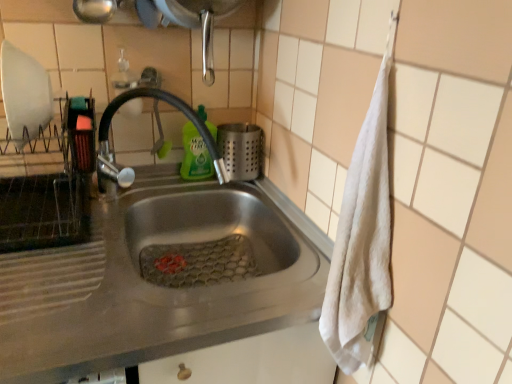
Question: Is satin silver utensil holder at sink bigger than stainless steel sink at center?

Choices:
 (A) no
 (B) yes

Answer: (A)

Question: From a real-world perspective, is satin silver utensil holder at sink physically above stainless steel sink at center?

Choices:
 (A) no
 (B) yes

Answer: (B)

Question: Does satin silver utensil holder at sink have a smaller size compared to stainless steel sink at center?

Choices:
 (A) yes
 (B) no

Answer: (A)

Question: Is satin silver utensil holder at sink aimed at stainless steel sink at center?

Choices:
 (A) yes
 (B) no

Answer: (B)

Question: From the image's perspective, would you say satin silver utensil holder at sink is shown under stainless steel sink at center?

Choices:
 (A) no
 (B) yes

Answer: (A)

Question: Does satin silver utensil holder at sink have a lesser width compared to stainless steel sink at center?

Choices:
 (A) no
 (B) yes

Answer: (B)

Question: Is satin silver utensil holder at sink oriented away from shiny metallic faucet at center?

Choices:
 (A) yes
 (B) no

Answer: (B)

Question: Is the depth of satin silver utensil holder at sink less than that of shiny metallic faucet at center?

Choices:
 (A) no
 (B) yes

Answer: (A)

Question: Is satin silver utensil holder at sink outside of shiny metallic faucet at center?

Choices:
 (A) yes
 (B) no

Answer: (A)

Question: From the image's perspective, does satin silver utensil holder at sink appear lower than shiny metallic faucet at center?

Choices:
 (A) yes
 (B) no

Answer: (A)

Question: Considering the relative sizes of satin silver utensil holder at sink and shiny metallic faucet at center in the image provided, is satin silver utensil holder at sink shorter than shiny metallic faucet at center?

Choices:
 (A) no
 (B) yes

Answer: (B)

Question: Is the depth of satin silver utensil holder at sink greater than that of shiny metallic faucet at center?

Choices:
 (A) yes
 (B) no

Answer: (A)

Question: Considering the relative positions of satin silver utensil holder at sink and green liquid at sink in the image provided, is satin silver utensil holder at sink to the right of green liquid at sink from the viewer's perspective?

Choices:
 (A) no
 (B) yes

Answer: (B)